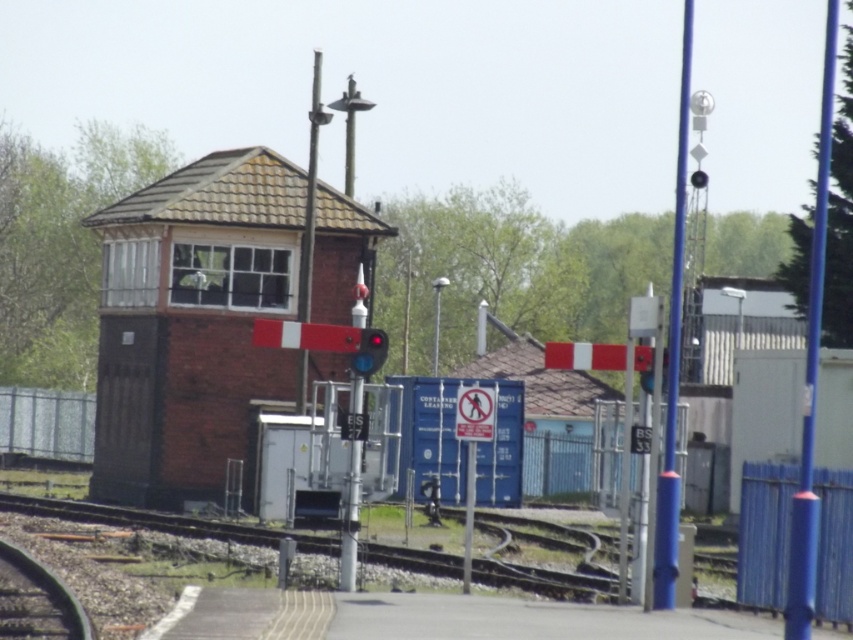
You are a train engineer approaching the railway tracks. You see the brick textured railway signal at center and the smooth metal rail at lower left. Which object is closer to your current position?

The brick textured railway signal at center is closer to your current position because it is further to the viewer than the smooth metal rail at lower left.

You are a train engineer approaching the railway tracks. You see two points marked on the tracks. The first point is at coordinate point (180,451) and the second point is at coordinate point (363,349). Which point is closer to the signal box located on the left side of the frame?

Point (180,451) is behind point (363,349), so the point closer to the signal box on the left side is point (363,349).